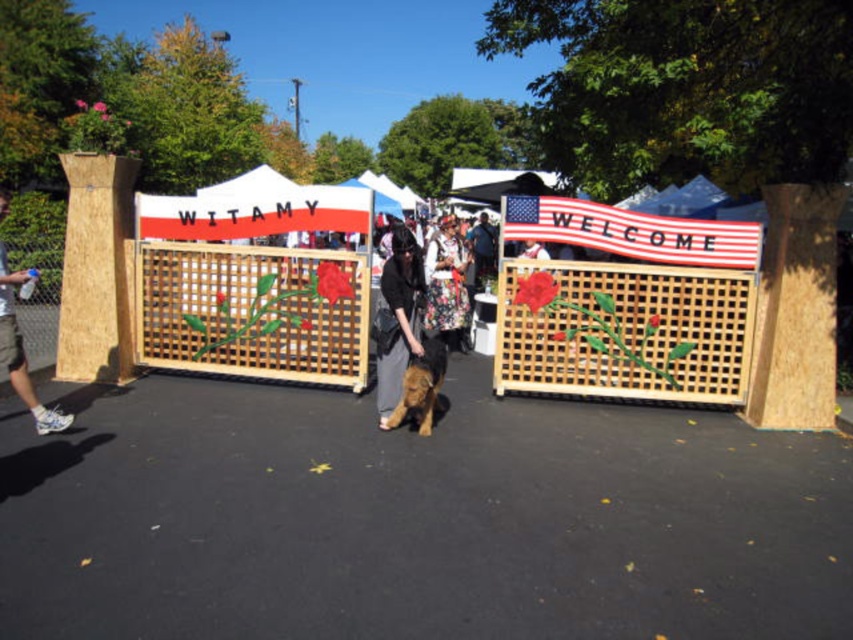
You are standing at the entrance of the event and want to take a photo. There are two points marked in the image, point 1 at coordinates point (279,273) and point 2 at coordinates point (54,419). Which point is closer to you?

Point (279,273) is further to the viewer than point (54,419), so point (54,419) is closer to you.

You are attending a community event and want to take a photo of the wooden lattice gate at center and the dark blue shirt at center. Which object should you focus on first to ensure both are in the frame?

You should focus on the wooden lattice gate at center first because it is in front of the dark blue shirt at center, so positioning the camera to include the gate will naturally include the shirt behind it in the frame.